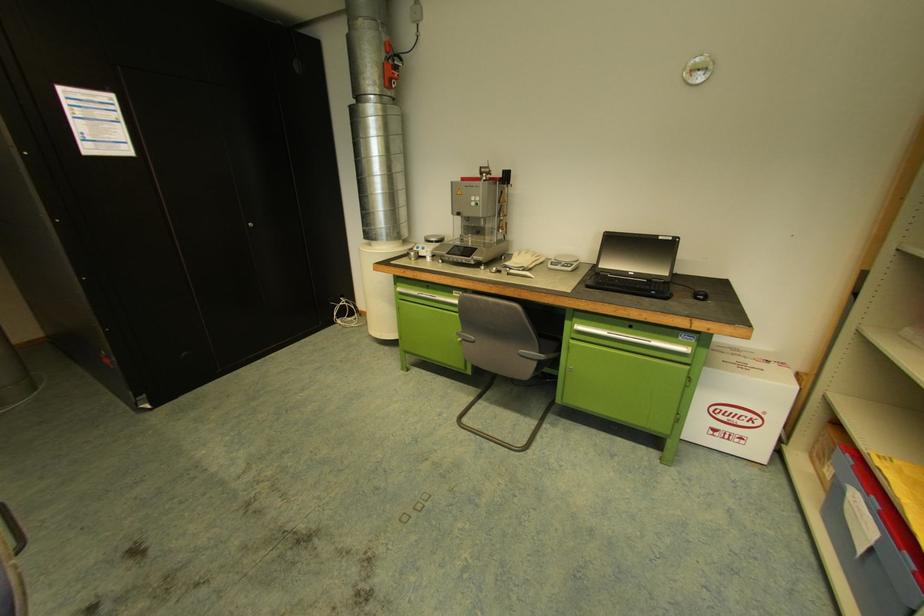
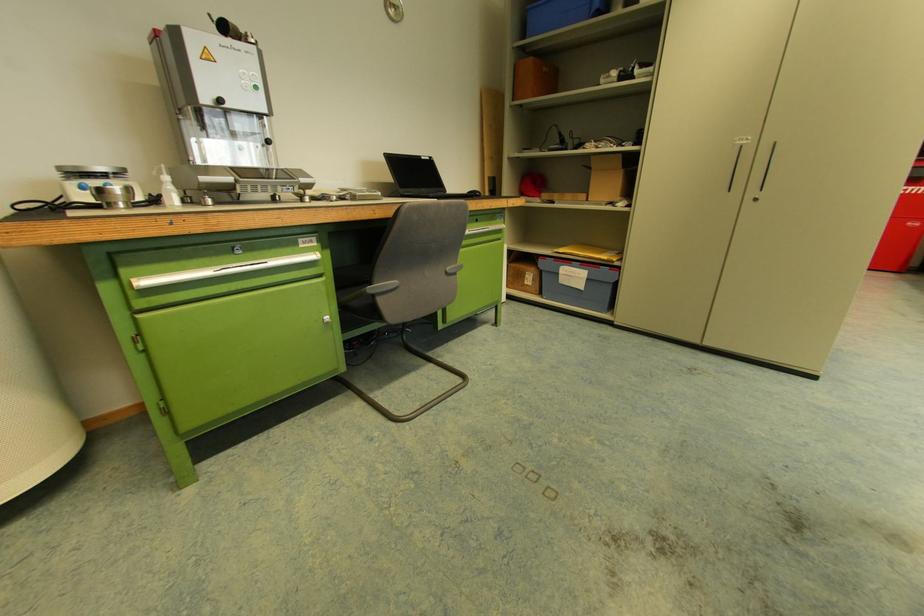
Find the pixel in the second image that matches the point at 417,259 in the first image.

(127, 207)